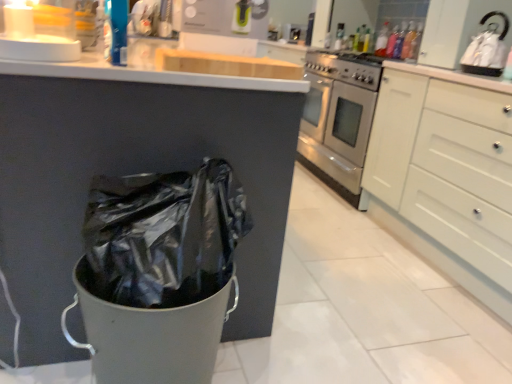
Question: Can you confirm if white matte cabinet at right is positioned to the right of white glossy kettle at upper right?

Choices:
 (A) yes
 (B) no

Answer: (A)

Question: Does white matte cabinet at right have a larger size compared to white glossy kettle at upper right?

Choices:
 (A) no
 (B) yes

Answer: (B)

Question: Is white matte cabinet at right further to the viewer compared to white glossy kettle at upper right?

Choices:
 (A) no
 (B) yes

Answer: (A)

Question: Is white matte cabinet at right looking in the opposite direction of white glossy kettle at upper right?

Choices:
 (A) no
 (B) yes

Answer: (A)

Question: From the image's perspective, does white matte cabinet at right appear lower than white glossy kettle at upper right?

Choices:
 (A) yes
 (B) no

Answer: (A)

Question: From the image's perspective, is white glossy kettle at upper right positioned above or below translucent plastic bottle at upper right, acting as the 2th bottle starting from the left?

Choices:
 (A) above
 (B) below

Answer: (B)

Question: Considering the positions of point (483, 43) and point (401, 56), is point (483, 43) closer or farther from the camera than point (401, 56)?

Choices:
 (A) farther
 (B) closer

Answer: (B)

Question: From their relative heights in the image, would you say white glossy kettle at upper right is taller or shorter than translucent plastic bottle at upper right, the first bottle positioned from the front?

Choices:
 (A) short
 (B) tall

Answer: (B)

Question: In terms of width, does white glossy kettle at upper right look wider or thinner when compared to translucent plastic bottle at upper right, the second bottle positioned from the back?

Choices:
 (A) thin
 (B) wide

Answer: (B)

Question: Considering the positions of translucent plastic bottle at upper right, which is counted as the second bottle, starting from the front, and translucent plastic bottle at upper right, the first bottle positioned from the front, in the image, is translucent plastic bottle at upper right, which is counted as the second bottle, starting from the front, taller or shorter than translucent plastic bottle at upper right, the first bottle positioned from the front,?

Choices:
 (A) short
 (B) tall

Answer: (A)

Question: Visually, is translucent plastic bottle at upper right, which is counted as the second bottle, starting from the front, positioned to the left or to the right of translucent plastic bottle at upper right, the second bottle positioned from the back?

Choices:
 (A) left
 (B) right

Answer: (A)

Question: From the image's perspective, is translucent plastic bottle at upper right, which is counted as the second bottle, starting from the front, positioned above or below translucent plastic bottle at upper right, the second bottle positioned from the back?

Choices:
 (A) above
 (B) below

Answer: (A)

Question: From a real-world perspective, is translucent plastic bottle at upper right, positioned as the 1th bottle in back-to-front order, physically located above or below translucent plastic bottle at upper right, the first bottle positioned from the front?

Choices:
 (A) below
 (B) above

Answer: (B)

Question: Visually, is matte white sink at upper center positioned to the left or to the right of translucent plastic bottle at upper right, which ranks as the second bottle in right-to-left order?

Choices:
 (A) right
 (B) left

Answer: (B)

Question: Considering the positions of point (289, 26) and point (386, 36), is point (289, 26) closer or farther from the camera than point (386, 36)?

Choices:
 (A) farther
 (B) closer

Answer: (A)